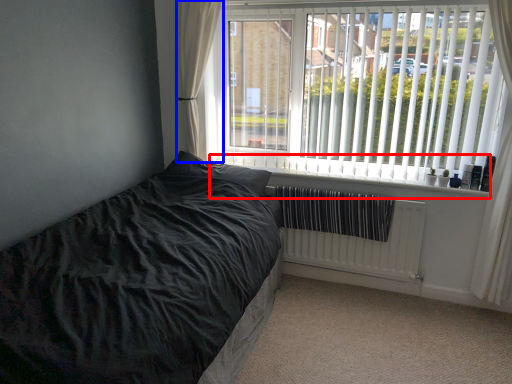
Question: Which of the following is the farthest to the observer, window sill (highlighted by a red box) or curtain (highlighted by a blue box)?

Choices:
 (A) window sill
 (B) curtain

Answer: (B)